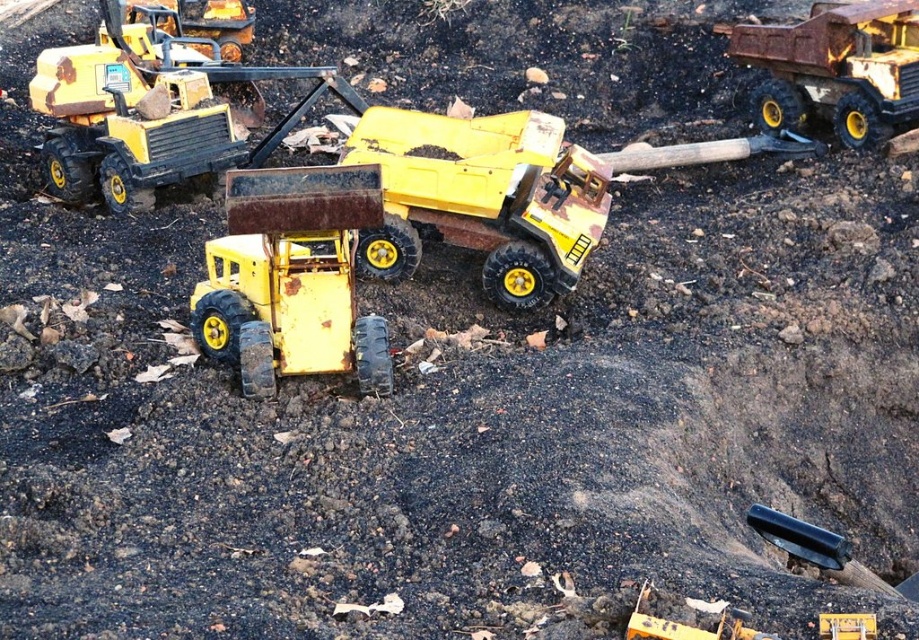
Question: Estimate the real-world distances between objects in this image. Which object is closer to the rusty yellow bulldozer at center?

Choices:
 (A) matte yellow toy truck at upper left
 (B) rusty metal dump truck at upper right
 (C) matte yellow dump truck at center

Answer: (C)

Question: Observing the image, what is the correct spatial positioning of matte yellow toy truck at upper left in reference to rusty metal dump truck at upper right?

Choices:
 (A) above
 (B) below

Answer: (B)

Question: Which point is farther to the camera?

Choices:
 (A) (824, 100)
 (B) (118, 172)

Answer: (A)

Question: Which of the following is the farthest from the observer?

Choices:
 (A) rusty yellow bulldozer at center
 (B) rusty metal dump truck at upper right

Answer: (B)

Question: Can you confirm if matte yellow dump truck at center is wider than matte yellow toy truck at upper left?

Choices:
 (A) yes
 (B) no

Answer: (B)

Question: Can you confirm if matte yellow toy truck at upper left is wider than rusty metal dump truck at upper right?

Choices:
 (A) no
 (B) yes

Answer: (B)